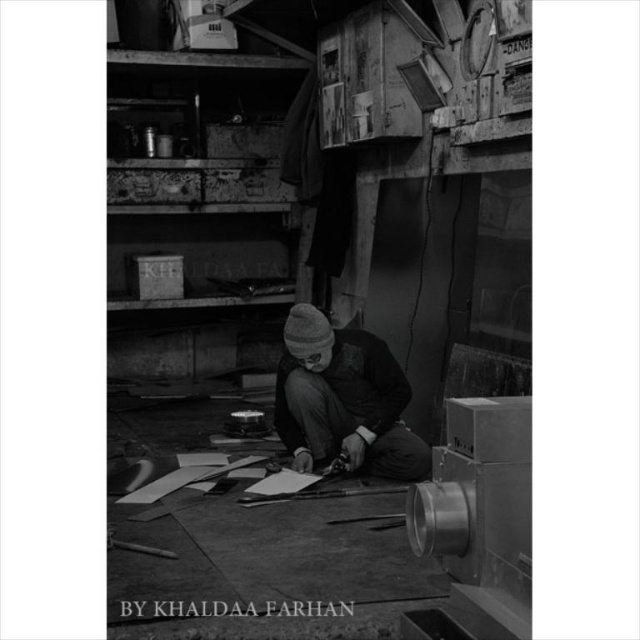
Does point (385, 40) come closer to viewer compared to point (285, 323)?

Yes, it is in front of point (285, 323).

Is metallic sheen scissors at center behind dark gray knit hat at center?

No.

Is point (356, 273) positioned behind point (358, 378)?

That is True.

The height and width of the screenshot is (640, 640). I want to click on metallic sheen scissors at center, so click(x=330, y=280).